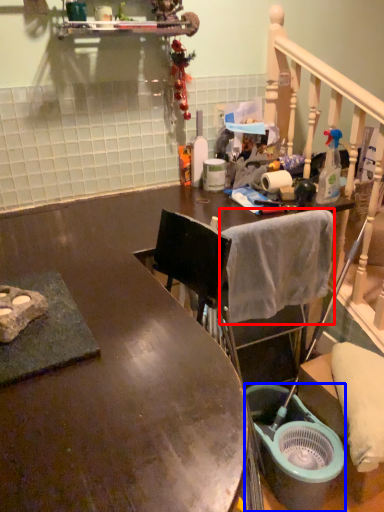
Question: Which of the following is the farthest to the observer, bath towel (highlighted by a red box) or bucket (highlighted by a blue box)?

Choices:
 (A) bath towel
 (B) bucket

Answer: (B)